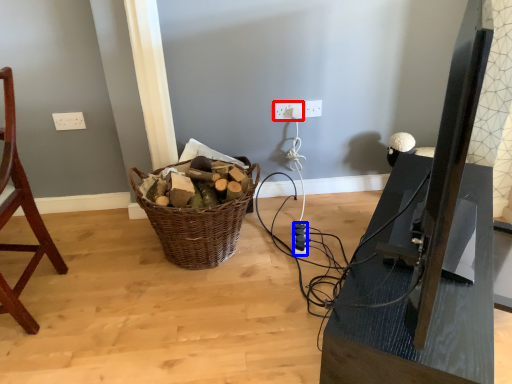
Question: Which object appears closest to the camera in this image, electric outlet (highlighted by a red box) or extension cord (highlighted by a blue box)?

Choices:
 (A) electric outlet
 (B) extension cord

Answer: (B)